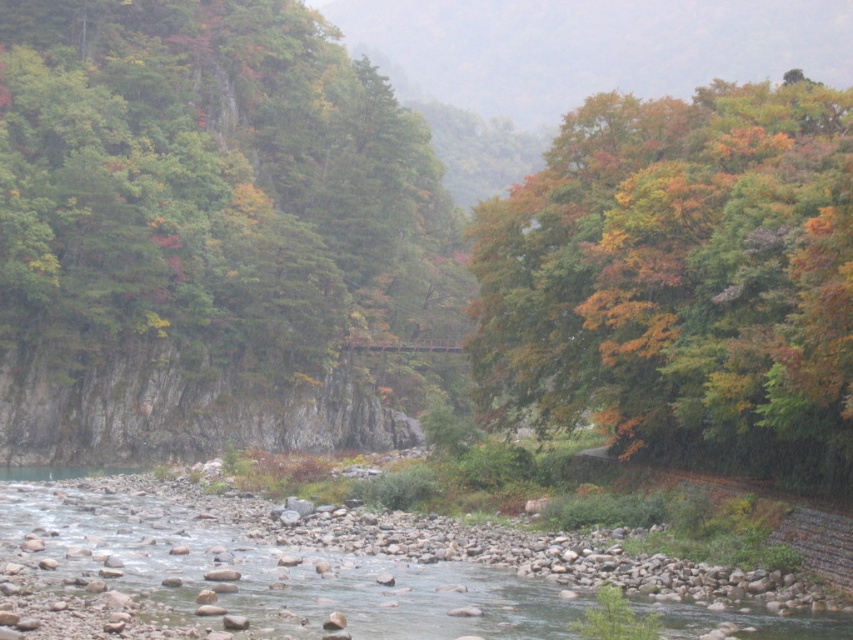
Is green matte tree at upper left shorter than multicolored foliage at upper right?

In fact, green matte tree at upper left may be taller than multicolored foliage at upper right.

Is point (241, 372) closer to viewer compared to point (802, 440)?

No, it is behind (802, 440).

Image resolution: width=853 pixels, height=640 pixels. In order to click on green matte tree at upper left in this screenshot , I will do `click(213, 236)`.